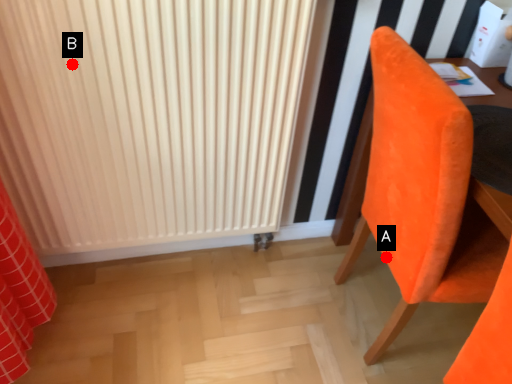
Question: Two points are circled on the image, labeled by A and B beside each circle. Among these points, which one is farthest from the camera?

Choices:
 (A) A is further
 (B) B is further

Answer: (A)